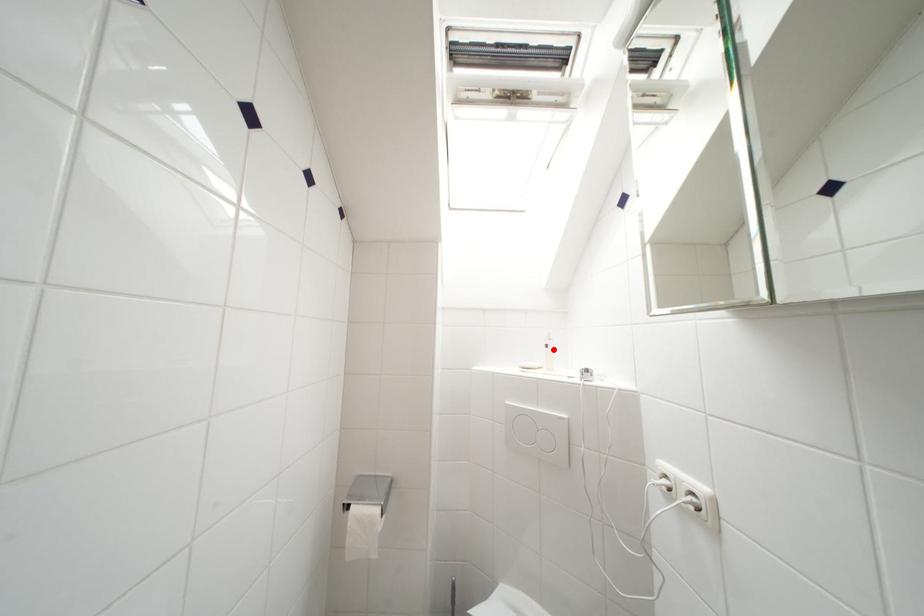
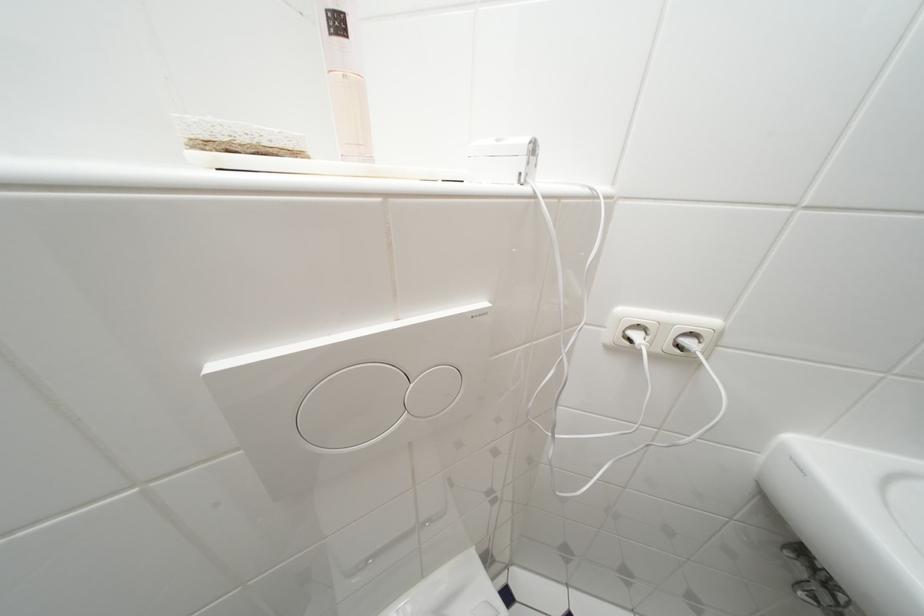
Locate, in the second image, the point that corresponds to the highlighted location in the first image.

(345, 26)